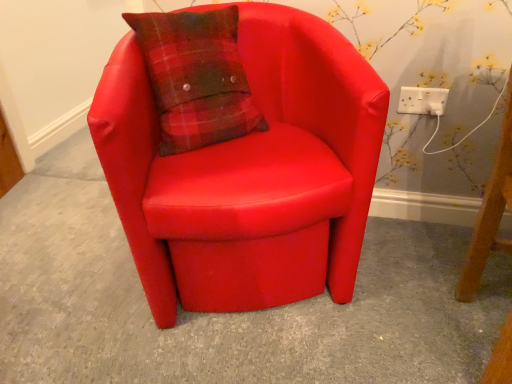
Image resolution: width=512 pixels, height=384 pixels. What are the coordinates of `blank space to the left of matte red armchair at center` in the screenshot? It's located at (71, 264).